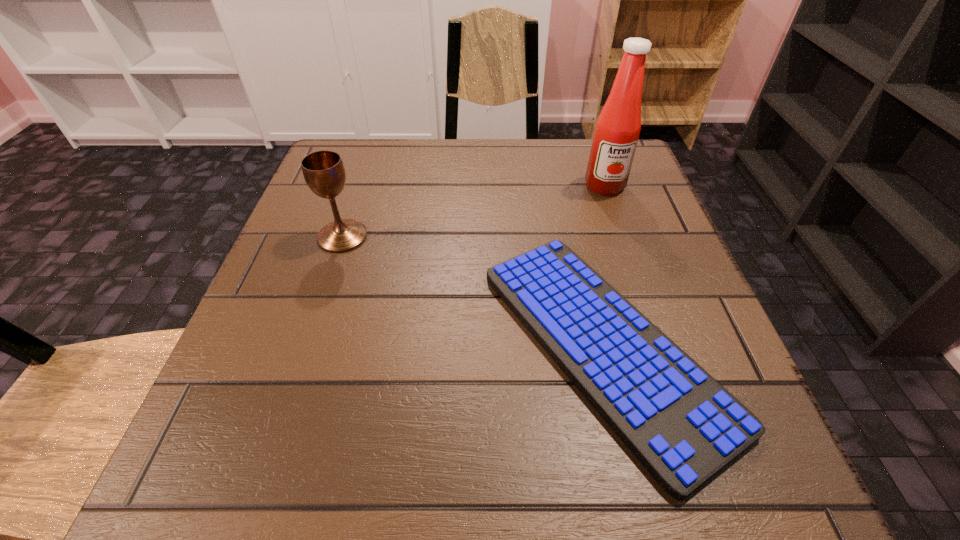
What are the coordinates of `vacant space in between the shortest object and the chalice` in the screenshot? It's located at (472, 291).

Identify which object is located as the second nearest to the chalice. Please provide its 2D coordinates. Your answer should be formatted as a tuple, i.e. [(x, y)], where the tuple contains the x and y coordinates of a point satisfying the conditions above.

[(617, 130)]

Where is `object that ranks as the second closest to the chalice`? Image resolution: width=960 pixels, height=540 pixels. object that ranks as the second closest to the chalice is located at coordinates (617, 130).